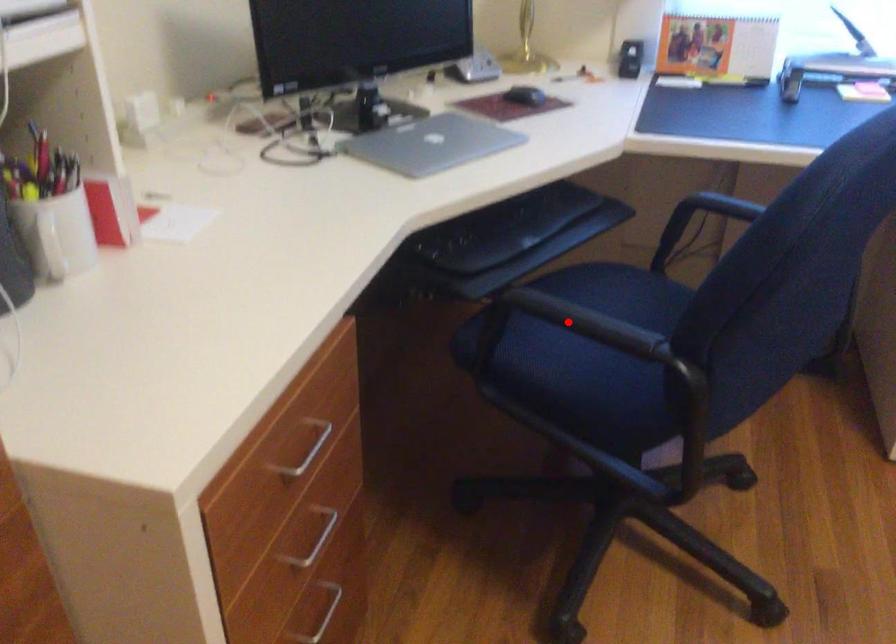
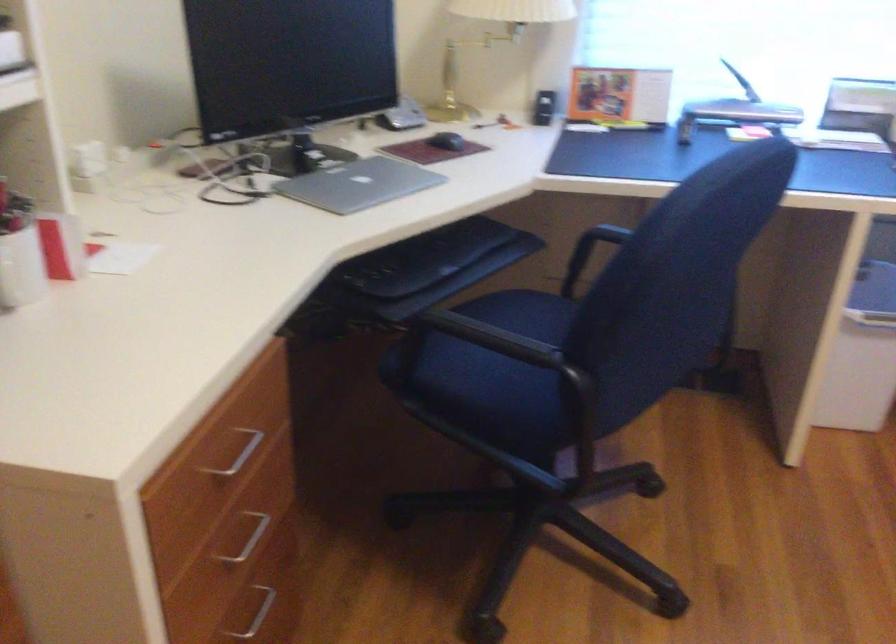
Question: I am providing you with two images of the same scene from different viewpoints. In image1, a red point is highlighted. Considering the same 3D point in image2, which of the following is correct?

Choices:
 (A) It is closer
 (B) It is farther

Answer: (B)